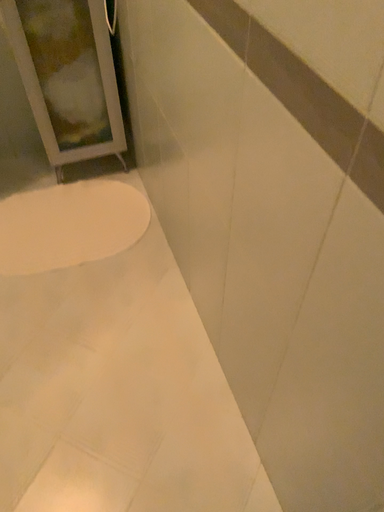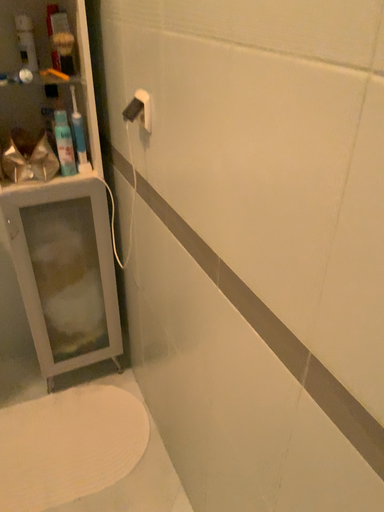
Question: How did the camera likely rotate when shooting the video?

Choices:
 (A) rotated downward
 (B) rotated upward

Answer: (B)